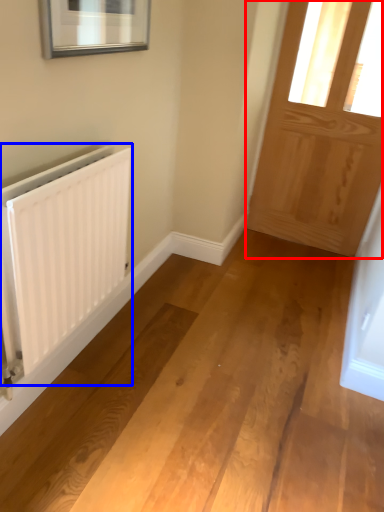
Question: Which object is further to the camera taking this photo, door (highlighted by a red box) or radiator (highlighted by a blue box)?

Choices:
 (A) door
 (B) radiator

Answer: (A)